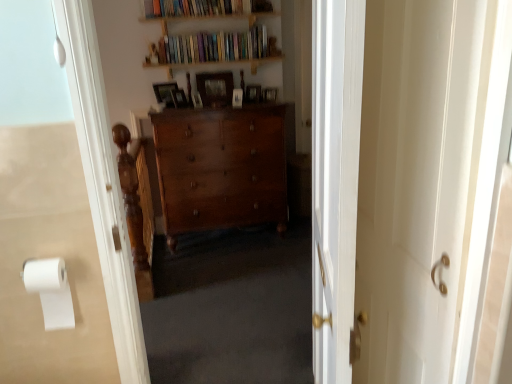
Find the location of `free location in front of wooden picture frame at center, which ranks as the 2th picture frame in right-to-left order`. free location in front of wooden picture frame at center, which ranks as the 2th picture frame in right-to-left order is located at coordinates (253, 111).